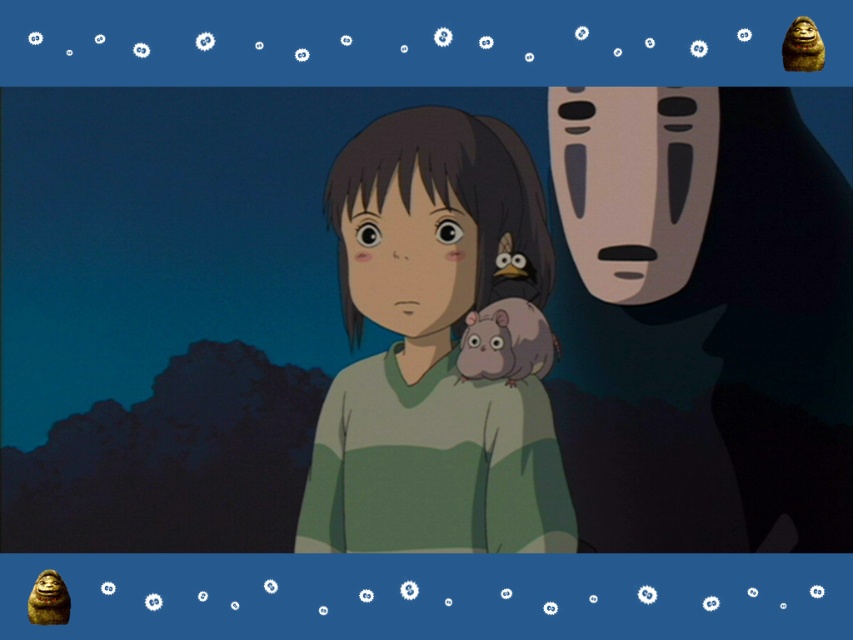
Question: Considering the relative positions of brown furry monkey at upper right and shiny golden statue at bottom left in the image provided, where is brown furry monkey at upper right located with respect to shiny golden statue at bottom left?

Choices:
 (A) right
 (B) left

Answer: (A)

Question: Which point is farther to the camera?

Choices:
 (A) fuzzy gray hamster at center
 (B) brown furry monkey at upper right

Answer: (A)

Question: Is brown furry monkey at upper right further to the viewer compared to shiny golden statue at bottom left?

Choices:
 (A) no
 (B) yes

Answer: (B)

Question: Does smooth green sweater at center appear on the left side of shiny golden statue at bottom left?

Choices:
 (A) no
 (B) yes

Answer: (A)

Question: Which point is farther to the camera?

Choices:
 (A) (509, 371)
 (B) (67, 611)

Answer: (A)

Question: Which of these objects is positioned closest to the fuzzy gray hamster at center?

Choices:
 (A) shiny golden statue at bottom left
 (B) smooth green sweater at center
 (C) brown furry monkey at upper right

Answer: (B)